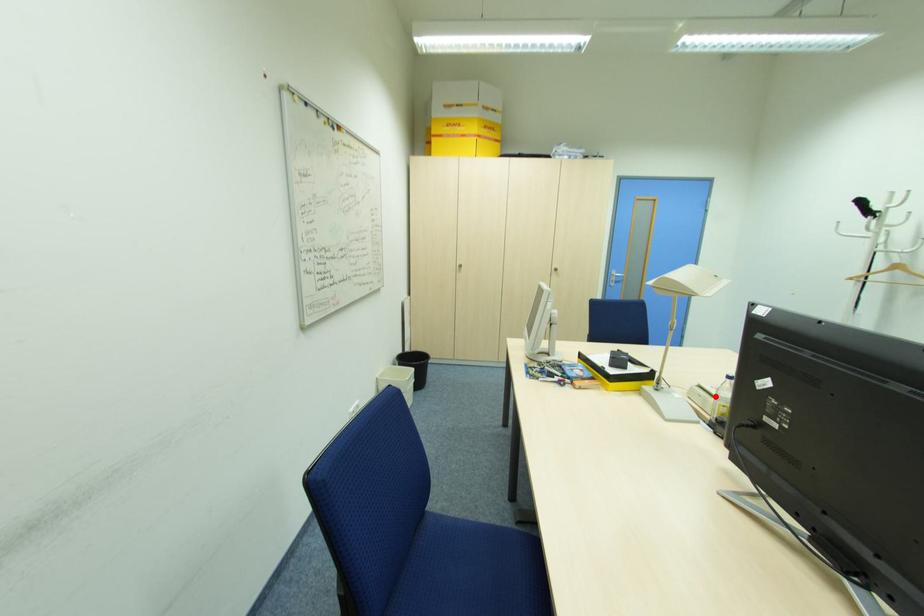
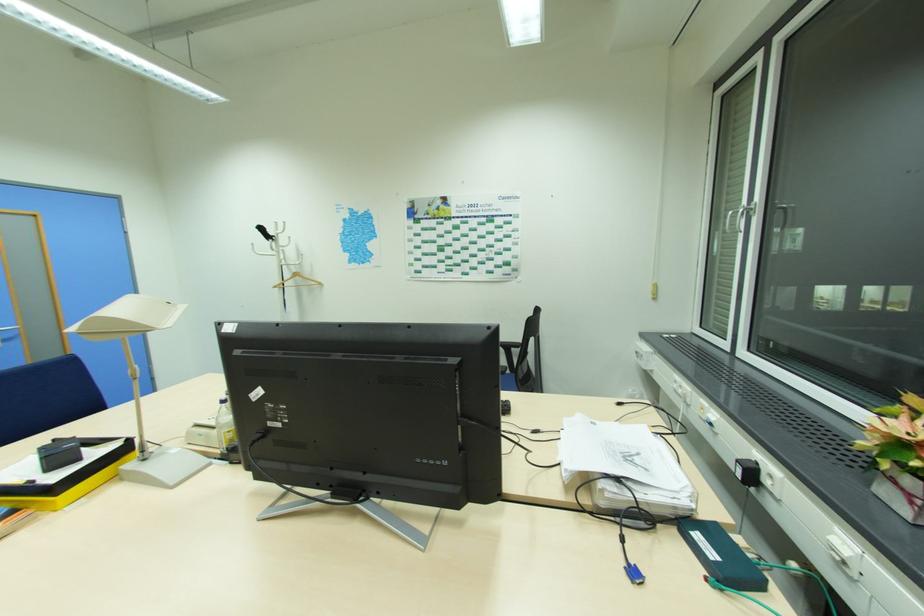
Question: A red point is marked in image1. In image2, is the corresponding 3D point closer to the camera or farther? Reply with the corresponding letter.

Choices:
 (A) The corresponding 3D point is closer.
 (B) The corresponding 3D point is farther.

Answer: (B)